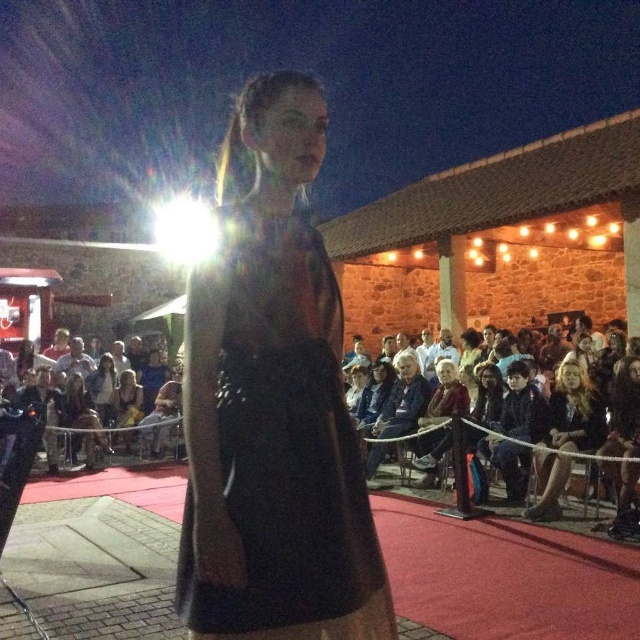
Question: Does matte black dress at center have a smaller size compared to blonde hair at right?

Choices:
 (A) yes
 (B) no

Answer: (A)

Question: Among these objects, which one is nearest to the camera?

Choices:
 (A) dark blue fabric jacket at lower right
 (B) denim jacket at center

Answer: (A)

Question: Among these objects, which one is farthest from the camera?

Choices:
 (A) matte black dress at center
 (B) blonde hair at right
 (C) dark fabric chairs at center
 (D) dark blue fabric jacket at lower right

Answer: (D)

Question: In this image, where is matte black dress at center located relative to dark fabric chairs at center?

Choices:
 (A) below
 (B) above

Answer: (B)

Question: Can you confirm if matte black dress at center is positioned to the left of dark blue fabric jacket at lower right?

Choices:
 (A) yes
 (B) no

Answer: (A)

Question: Which point is farther from the camera taking this photo?

Choices:
 (A) (244, 340)
 (B) (529, 406)
 (C) (577, 448)

Answer: (B)